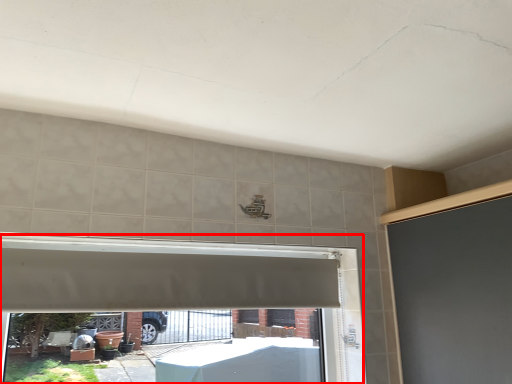
Question: From the image's perspective, considering the relative positions of window frame (annotated by the red box) and exhaust hood in the image provided, where is window frame (annotated by the red box) located with respect to the staircase?

Choices:
 (A) above
 (B) below

Answer: (B)